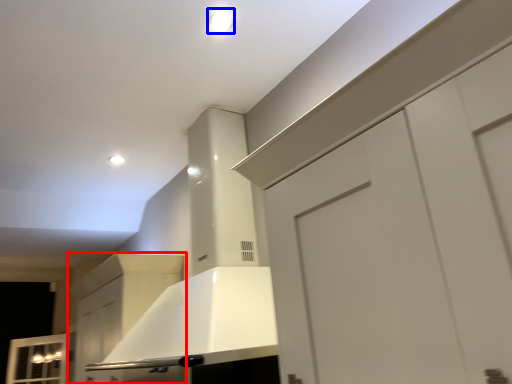
Question: Which object is further to the camera taking this photo, cabinetry (highlighted by a red box) or lighting (highlighted by a blue box)?

Choices:
 (A) cabinetry
 (B) lighting

Answer: (A)